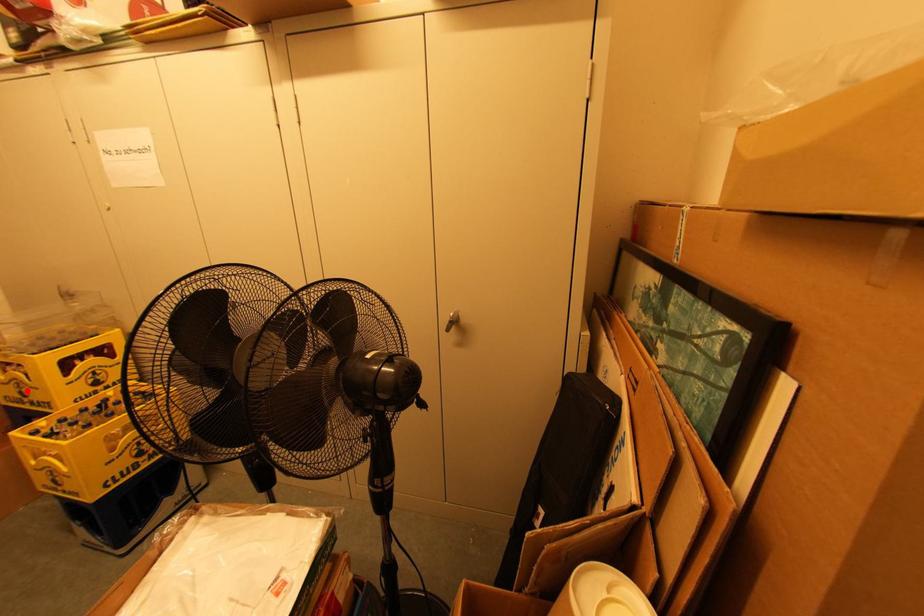
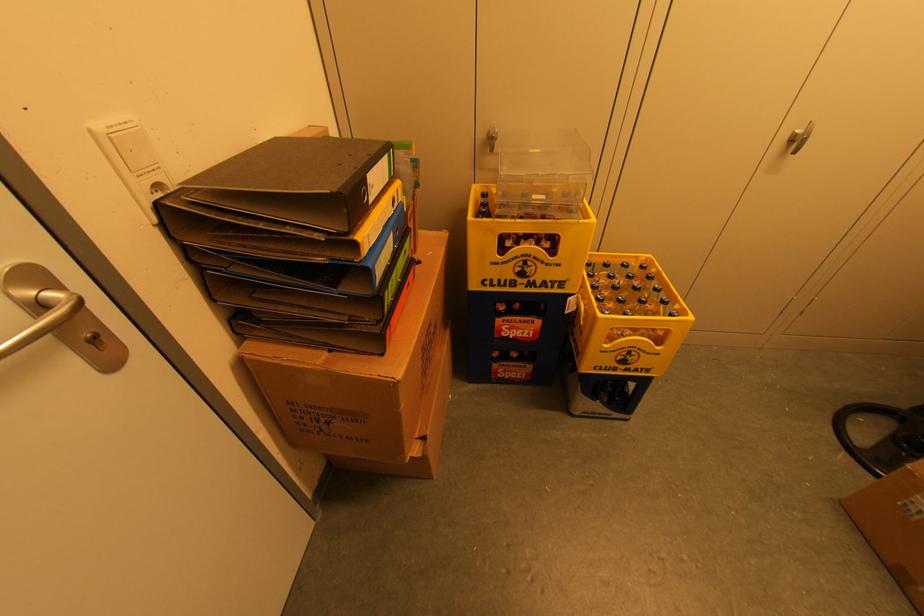
Question: I am providing you with two images of the same scene from different viewpoints. A red point is shown in image1. For the corresponding object point in image2, is it positioned nearer or farther from the camera?

Choices:
 (A) Nearer
 (B) Farther

Answer: (A)